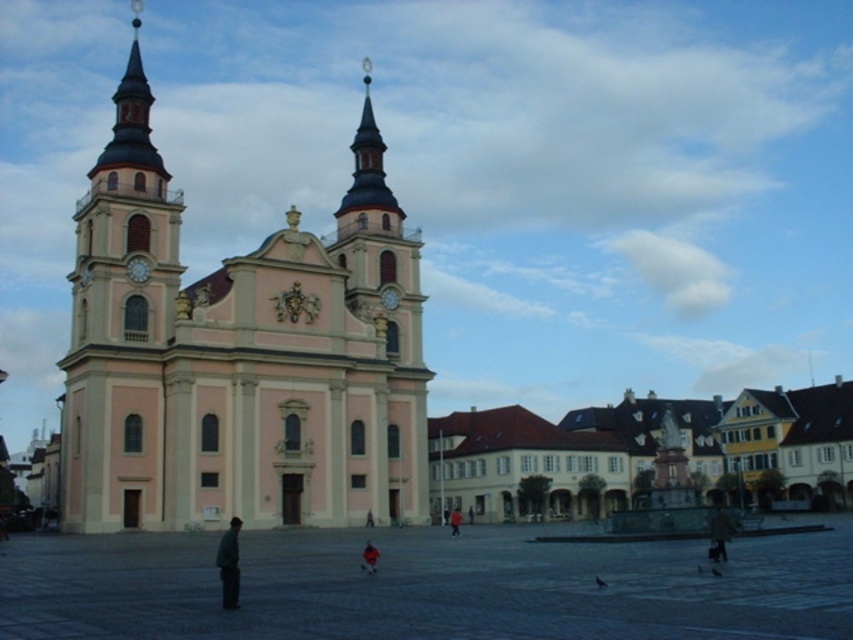
Describe the element at coordinates (239, 355) in the screenshot. This screenshot has width=853, height=640. I see `pink smooth church at center` at that location.

Measure the distance between pink smooth church at center and camera.

A distance of 64.09 meters exists between pink smooth church at center and camera.

Is point (122, 147) in front of point (144, 396)?

No.

You are a GUI agent. You are given a task and a screenshot of the screen. Output one action in this format:
    pyautogui.click(x=<x>, y=<y>)
    Task: Click on the pink smooth church at center
    This screenshot has width=853, height=640.
    Given the screenshot: What is the action you would take?
    pyautogui.click(x=239, y=355)

The image size is (853, 640). Find the location of `smooth pink tower at left`. smooth pink tower at left is located at coordinates (120, 324).

Who is more distant from viewer, (119, 276) or (505, 426)?

Point (505, 426)

This screenshot has width=853, height=640. Identify the location of smooth pink tower at left. (120, 324).

Who is taller, smooth pink tower at left or red fabric jacket at center?

smooth pink tower at left is taller.

What do you see at coordinates (120, 324) in the screenshot?
I see `smooth pink tower at left` at bounding box center [120, 324].

Does point (94, 524) lie behind point (454, 513)?

No, (94, 524) is closer to viewer.

I want to click on smooth pink tower at left, so click(120, 324).